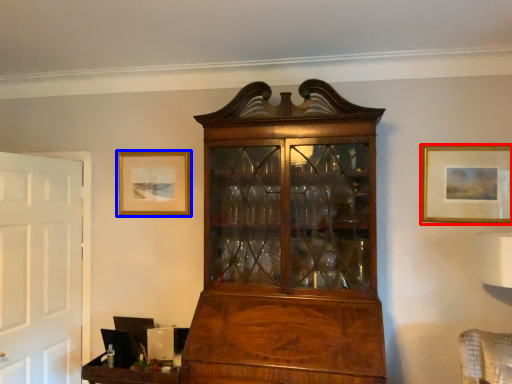
Question: Which point is further to the camera, picture frame (highlighted by a red box) or picture frame (highlighted by a blue box)?

Choices:
 (A) picture frame
 (B) picture frame

Answer: (B)